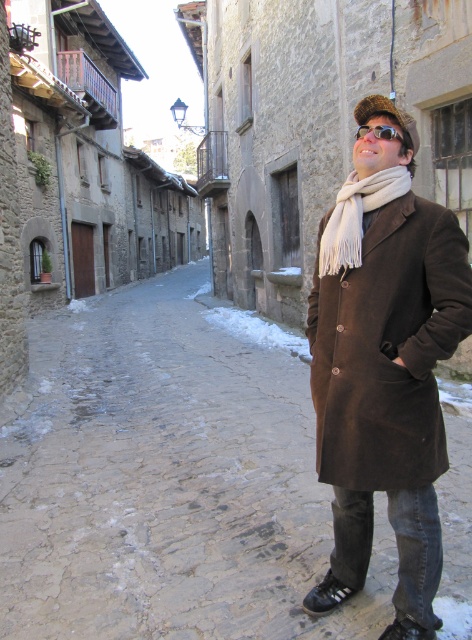
Locate an element on the screen. The height and width of the screenshot is (640, 472). brown suede coat at right is located at coordinates (167, 483).

Which is behind, point (244, 445) or point (392, 125)?

Point (244, 445)

Locate an element on the screen. brown suede coat at right is located at coordinates (167, 483).

Which is more to the right, white fringed scarf at center or sunglasses at upper center?

sunglasses at upper center is more to the right.

Is point (352, 172) positioned behind point (361, 129)?

Yes, point (352, 172) is behind point (361, 129).

Is point (382, 196) closer to viewer compared to point (382, 131)?

No, it is not.

In order to click on white fringed scarf at center in this screenshot , I will do `click(356, 216)`.

Consider the image. Can you confirm if brown suede coat at right is wider than white fringed scarf at center?

Yes, brown suede coat at right is wider than white fringed scarf at center.

Identify the location of brown suede coat at right. (167, 483).